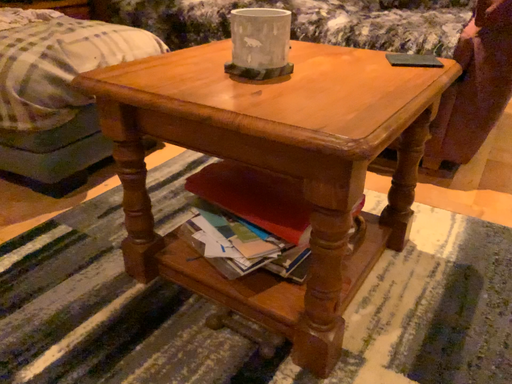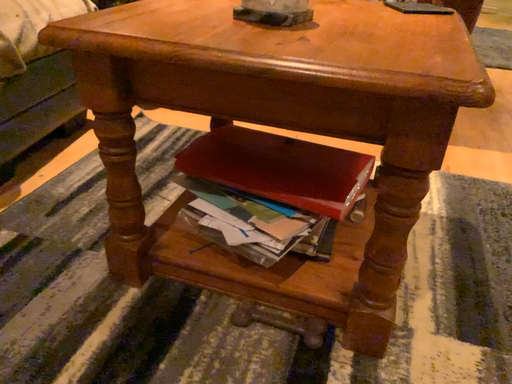
Question: Which way did the camera rotate in the video?

Choices:
 (A) rotated left
 (B) rotated right

Answer: (B)